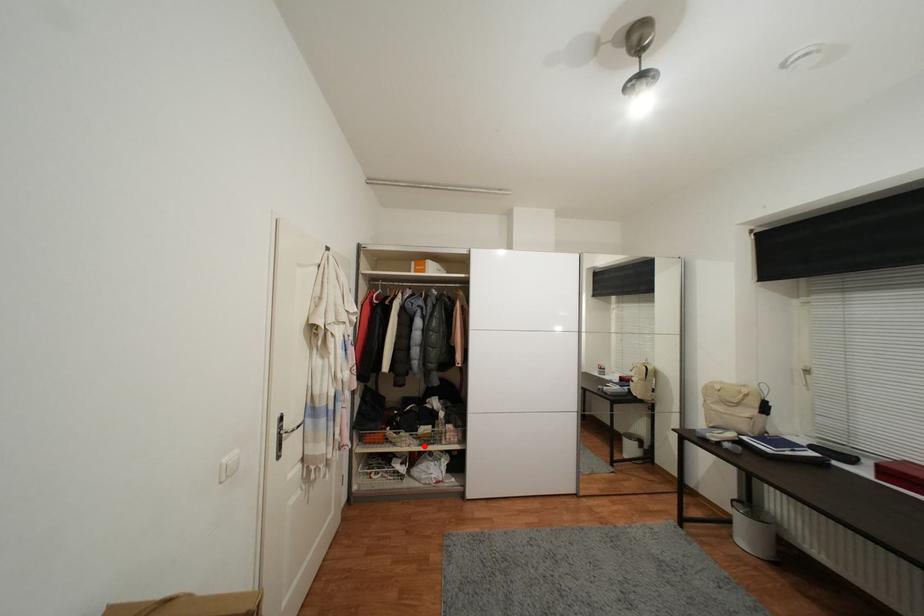
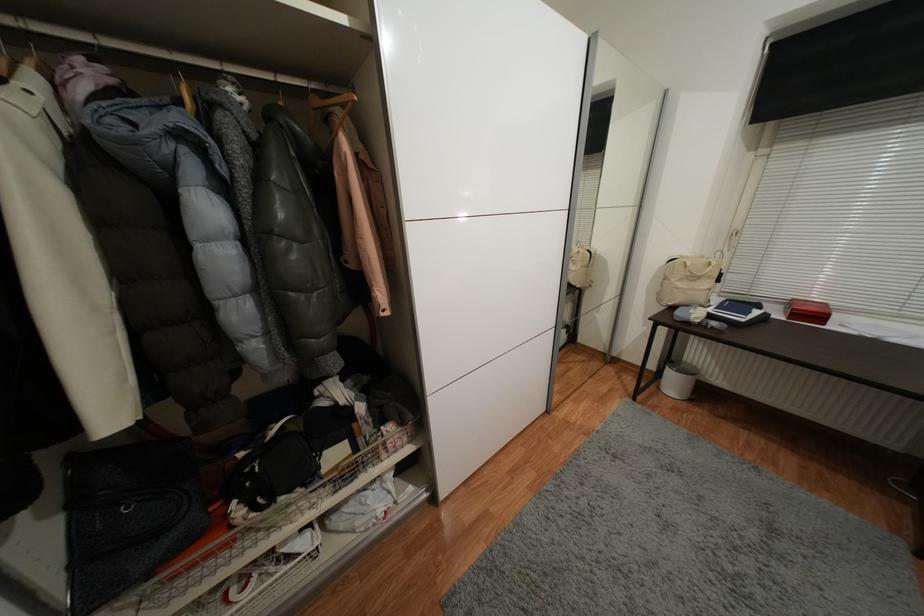
Find the pixel in the second image that matches the highlighted location in the first image.

(342, 493)